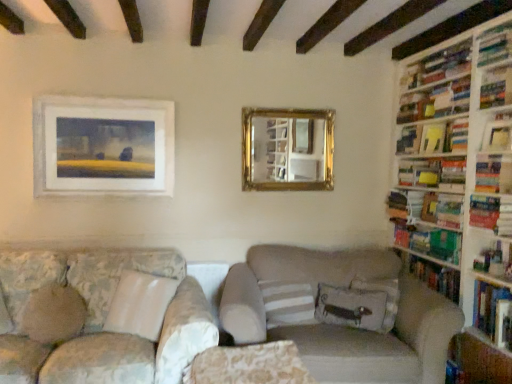
Question: From the image's perspective, is velvet floral pillow at center, which ranks as the third pillow in left-to-right order, positioned above or below hardcover book at right, the fourth book ordered from the bottom?

Choices:
 (A) above
 (B) below

Answer: (B)

Question: Is velvet floral pillow at center, which ranks as the third pillow in left-to-right order, inside the boundaries of hardcover book at right, the fourth book ordered from the bottom, or outside?

Choices:
 (A) inside
 (B) outside

Answer: (B)

Question: Estimate the real-world distances between objects in this image. Which object is farther from the white matte painting at upper left, which ranks as the first picture frame in front-to-back order?

Choices:
 (A) beige fabric couch at center, acting as the 1th studio couch starting from the right
 (B) floral fabric couch at lower left, which is the 1th studio couch in left-to-right order
 (C) hardcover book at upper right, positioned as the 1th book in top-to-bottom order
 (D) green matte bookshelf at right, positioned as the 8th book in top-to-bottom order
 (E) hardcover books at upper right, positioned as the 1th shelf in top-to-bottom order

Answer: (C)

Question: Which is farther from the floral fabric couch at lower left, which is the 1th studio couch in left-to-right order?

Choices:
 (A) velvet floral pillow at center, which ranks as the third pillow in left-to-right order
 (B) white striped pillow at center, which is counted as the 2th pillow, starting from the right
 (C) hardcover book at right, which is the first book from bottom to top
 (D) yellow paper at upper right, the fifth book from the bottom
 (E) brown fabric pillow at left, which is the first pillow in left-to-right order

Answer: (D)